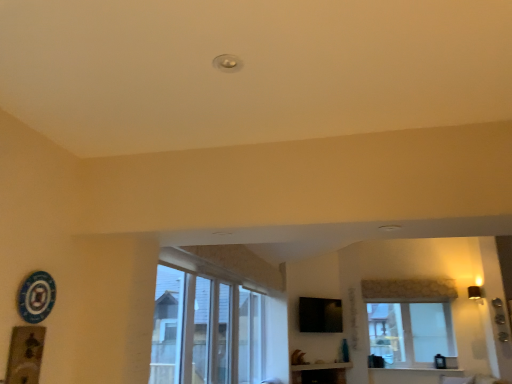
Question: Based on their sizes in the image, would you say white glass window at center is bigger or smaller than black glossy tv at upper center?

Choices:
 (A) big
 (B) small

Answer: (A)

Question: Is white glass window at center spatially inside black glossy tv at upper center, or outside of it?

Choices:
 (A) inside
 (B) outside

Answer: (B)

Question: Which is nearer to the black glossy tv at upper center?

Choices:
 (A) white textured wood at lower center
 (B) white glass window at center

Answer: (B)

Question: Estimate the real-world distances between objects in this image. Which object is closer to the black glossy tv at upper center?

Choices:
 (A) white glass window at center
 (B) white textured wood at lower center

Answer: (A)